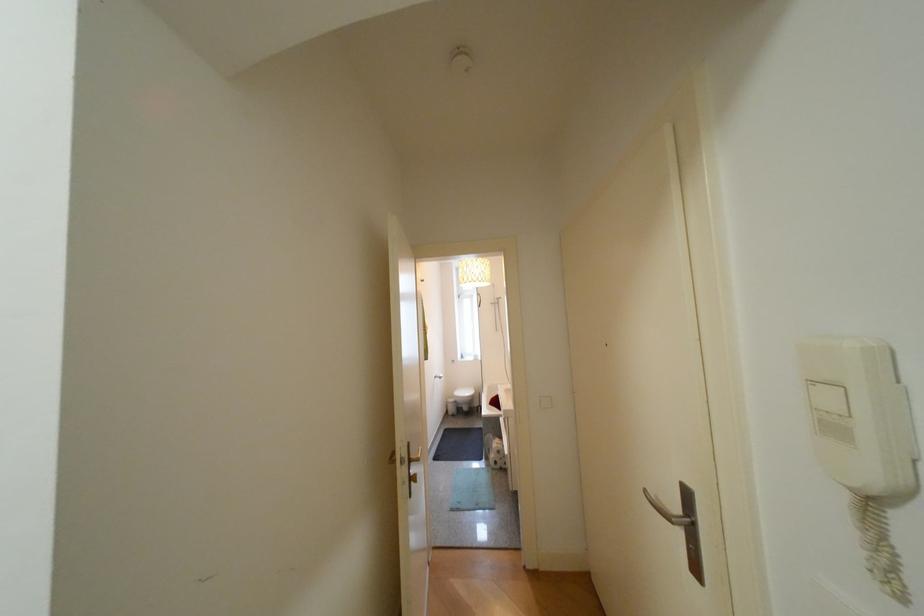
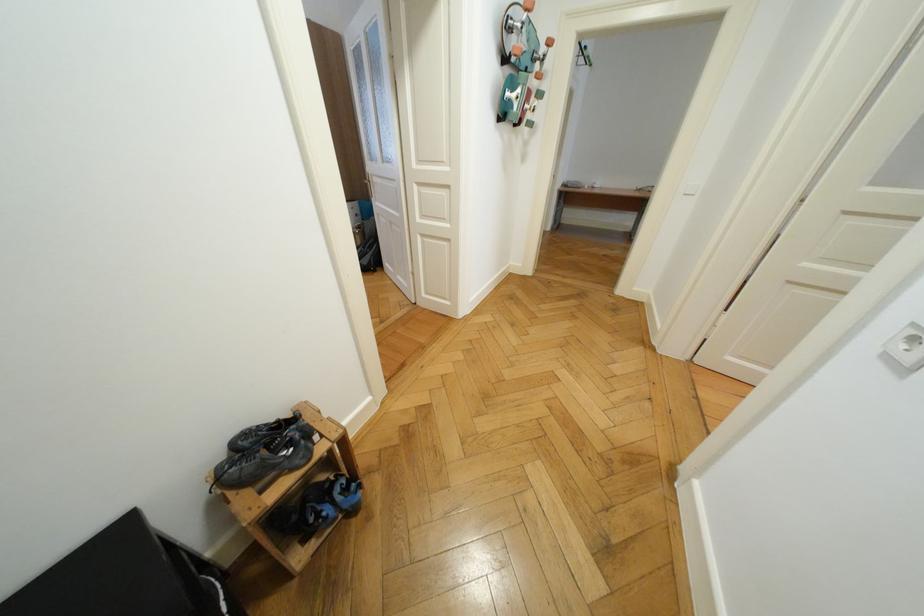
Looking at this image, how did the camera likely rotate?

The camera rotated toward left-down.